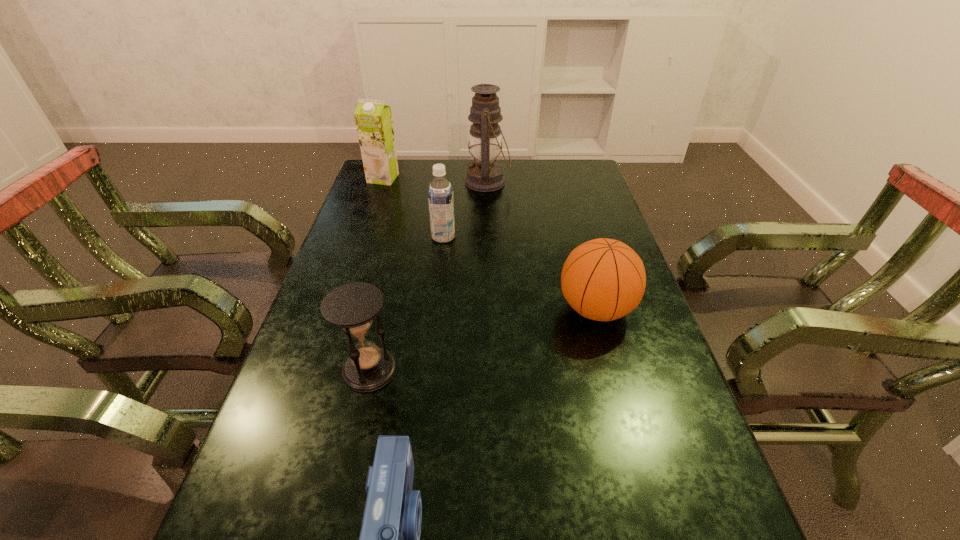
Find the location of a particular element. This screenshot has width=960, height=540. vacant space located 0.170m on the right of the farther soya milk is located at coordinates (444, 178).

This screenshot has width=960, height=540. In order to click on free space located 0.310m on the label of the shorter soya milk in this screenshot , I will do (x=557, y=237).

The height and width of the screenshot is (540, 960). I want to click on free spot located on the front of the fifth farthest object, so point(336,515).

Where is `vacant space located 0.370m on the back of the rightmost object`? vacant space located 0.370m on the back of the rightmost object is located at coordinates (567, 208).

Locate an element on the screen. This screenshot has height=540, width=960. oil lamp positioned at the far edge is located at coordinates (485, 175).

At what (x,y) coordinates should I click in order to perform the action: click on soya milk at the far edge. Please return your answer as a coordinate pair (x, y). Image resolution: width=960 pixels, height=540 pixels. Looking at the image, I should click on (373, 118).

At what (x,y) coordinates should I click in order to perform the action: click on soya milk located in the left edge section of the desktop. Please return your answer as a coordinate pair (x, y). The width and height of the screenshot is (960, 540). Looking at the image, I should click on [x=373, y=118].

Locate an element on the screen. hourglass at the left edge is located at coordinates (353, 306).

At what (x,y) coordinates should I click in order to perform the action: click on object that is positioned at the right edge. Please return your answer as a coordinate pair (x, y). This screenshot has height=540, width=960. Looking at the image, I should click on (603, 279).

You are a GUI agent. You are given a task and a screenshot of the screen. Output one action in this format:
    pyautogui.click(x=<x>, y=<y>)
    Task: Click on the object present at the far left corner
    
    Given the screenshot: What is the action you would take?
    pyautogui.click(x=373, y=118)